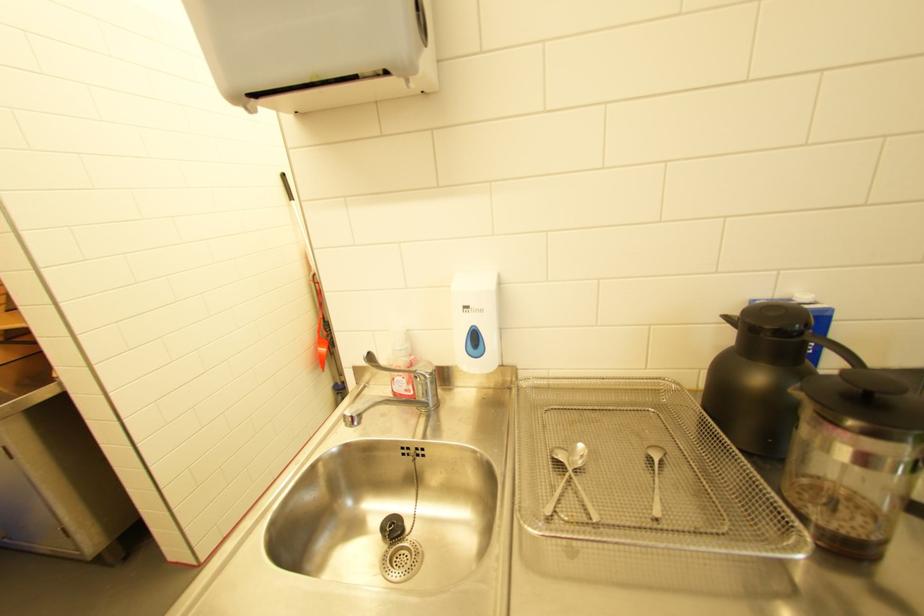
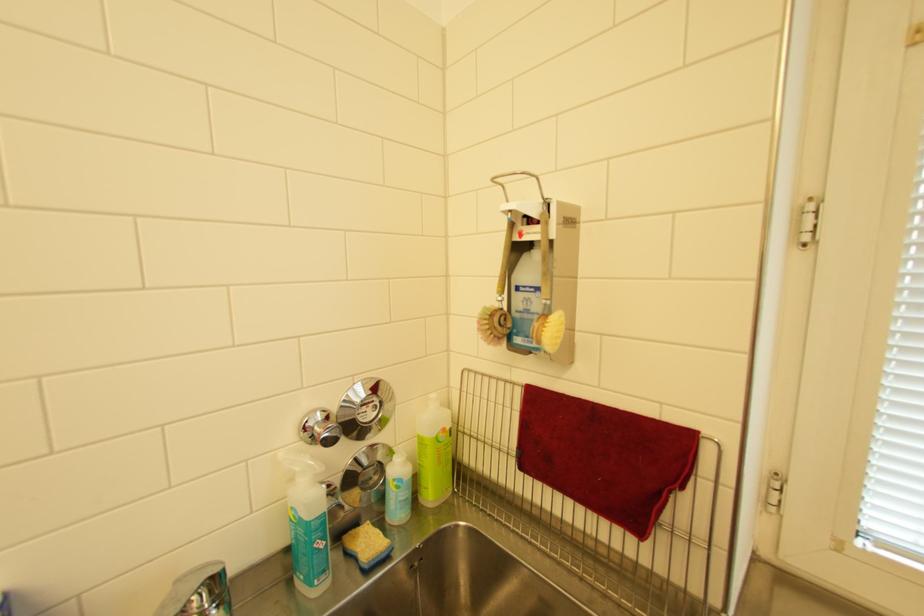
Question: The camera is either moving clockwise (left) or counter-clockwise (right) around the object. The first image is from the beginning of the video and the second image is from the end. Is the camera moving left or right when shooting the video?

Choices:
 (A) Left
 (B) Right

Answer: (A)